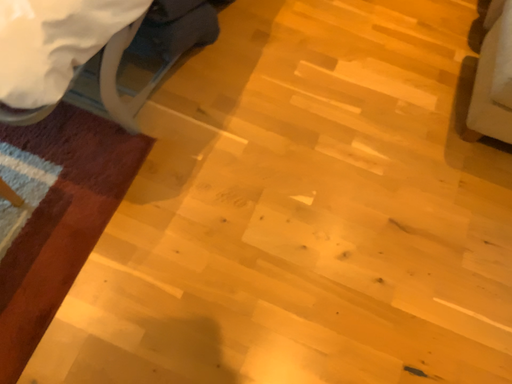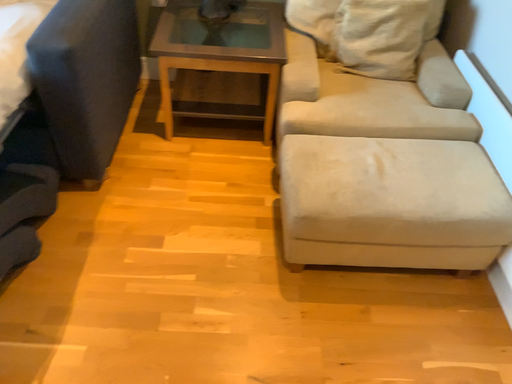
Question: Which way did the camera rotate in the video?

Choices:
 (A) rotated upward
 (B) rotated downward

Answer: (A)